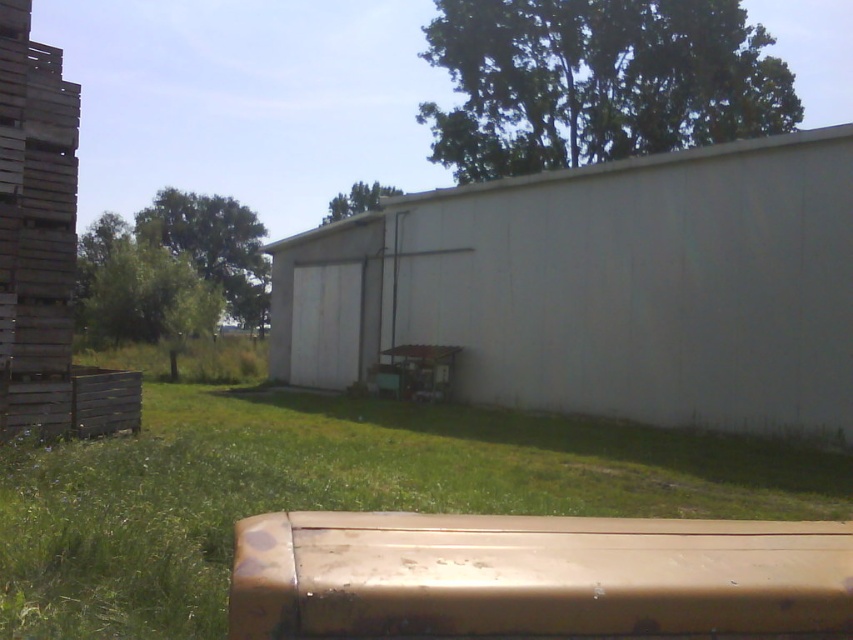
Question: Which point is closer to the camera taking this photo?

Choices:
 (A) [496, 342]
 (B) [196, 474]

Answer: (B)

Question: Is white concrete wall at center closer to the viewer compared to green grass at lower center?

Choices:
 (A) yes
 (B) no

Answer: (B)

Question: Does white concrete wall at center have a greater width compared to green grass at lower center?

Choices:
 (A) no
 (B) yes

Answer: (B)

Question: Does white concrete wall at center have a greater width compared to green grass at lower center?

Choices:
 (A) no
 (B) yes

Answer: (B)